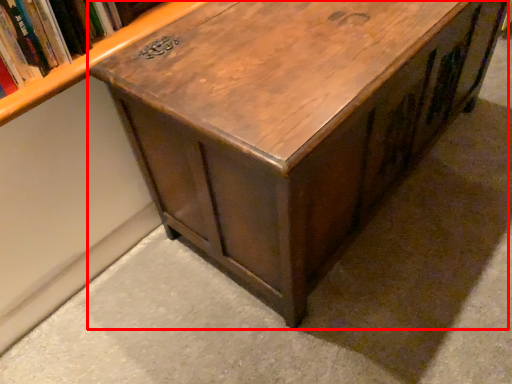
Question: From the image's perspective, considering the relative positions of table (annotated by the red box) and book in the image provided, where is table (annotated by the red box) located with respect to the staircase?

Choices:
 (A) above
 (B) below

Answer: (B)